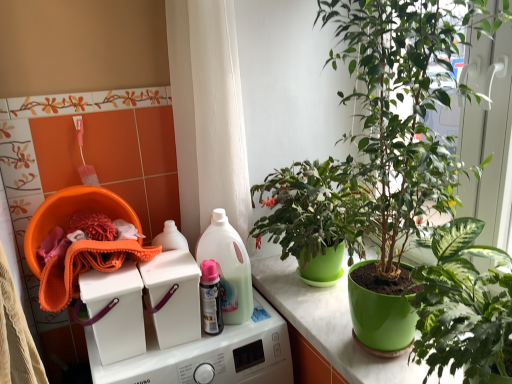
This screenshot has height=384, width=512. What are the coordinates of `vacant point to the left of pink glossy spray can at center` in the screenshot? It's located at (158, 350).